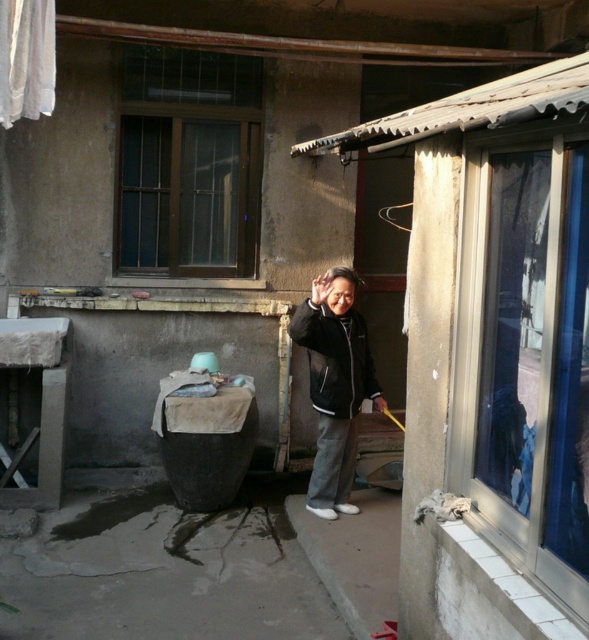
Which is below, dark brown wooden window at upper left or black matte jacket at center?

black matte jacket at center

Between point (234, 115) and point (343, 467), which one is positioned in front?

Point (343, 467) is more forward.

I want to click on dark brown wooden window at upper left, so click(x=188, y=163).

Who is taller, transparent glass window at right or black matte jacket at center?

transparent glass window at right is taller.

Who is higher up, transparent glass window at right or black matte jacket at center?

transparent glass window at right is above.

Is point (508, 536) closer to viewer compared to point (329, 308)?

Yes, point (508, 536) is in front of point (329, 308).

Where is `transparent glass window at right`? transparent glass window at right is located at coordinates (525, 349).

Between point (585, 570) and point (29, 38), which one is positioned behind?

The point (29, 38) is more distant.

Can you confirm if transparent glass window at right is positioned to the left of white fabric at upper left?

No, transparent glass window at right is not to the left of white fabric at upper left.

Between point (515, 189) and point (45, 13), which one is positioned in front?

Point (515, 189)

Locate an element on the screen. The height and width of the screenshot is (640, 589). transparent glass window at right is located at coordinates (525, 349).